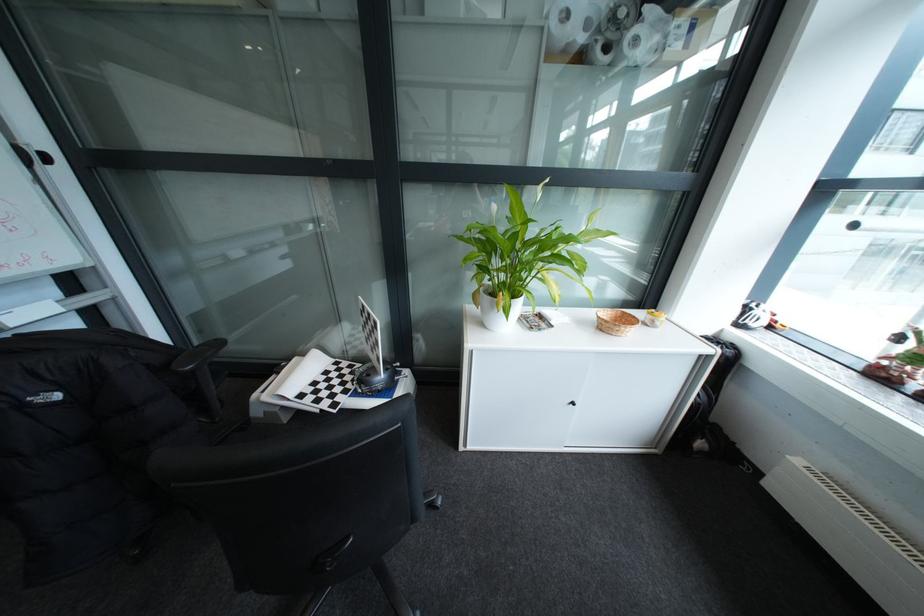
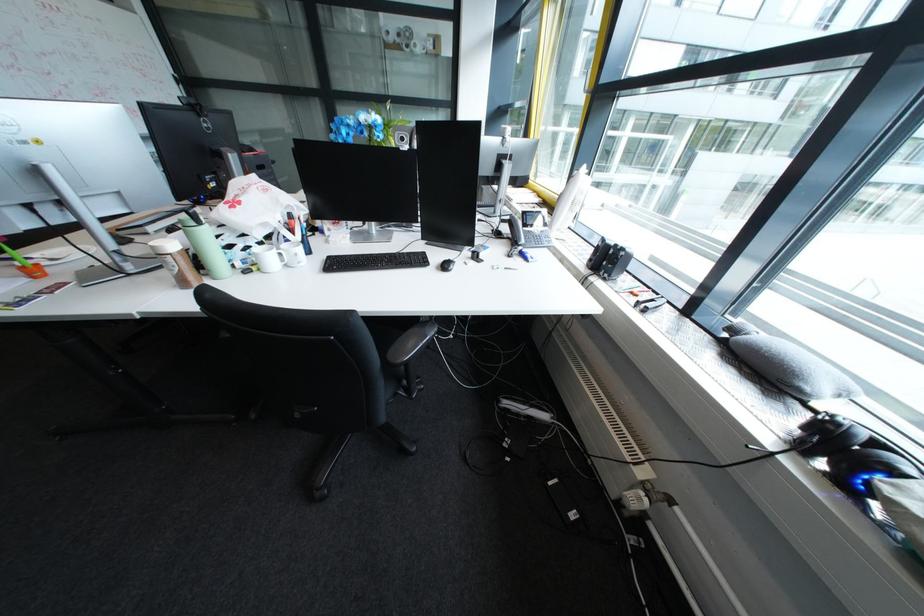
Question: I am providing you with two images of the same scene from different viewpoints. After the viewpoint changes to image2, which objects are now occluded?

Choices:
 (A) shower door handle
 (B) black headphones
 (C) small lidded jar
 (D) white mug

Answer: (C)